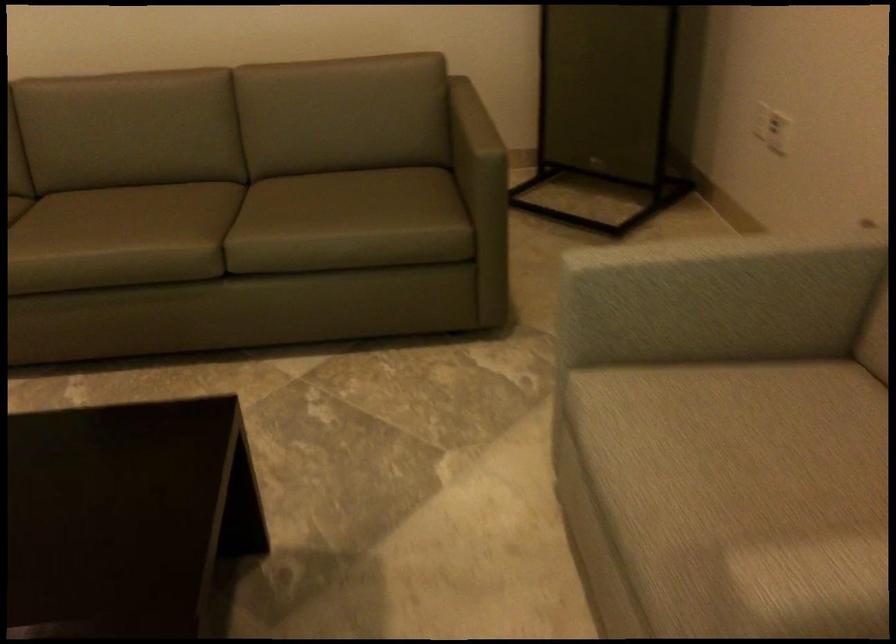
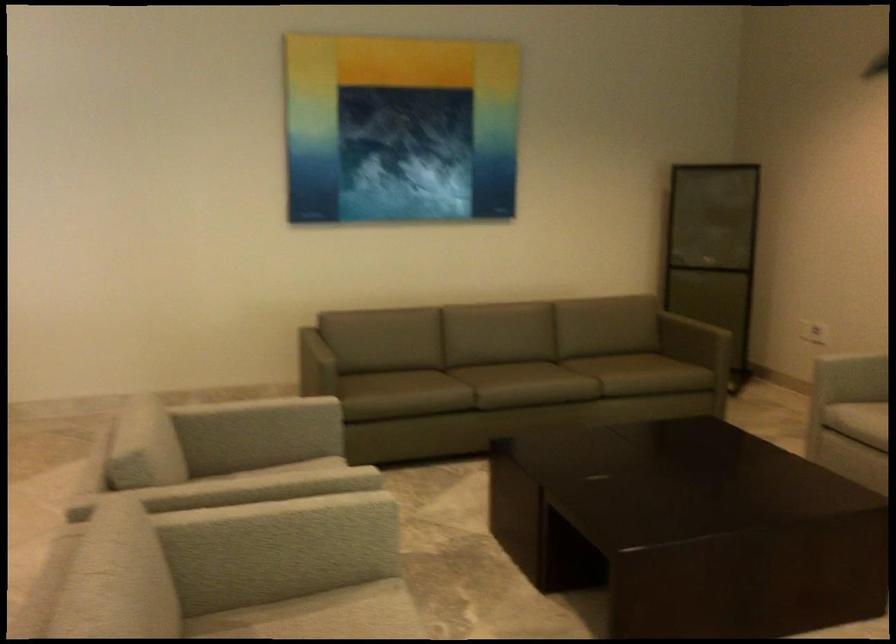
Where in the second image is the point corresponding to point (639, 108) from the first image?

(713, 317)